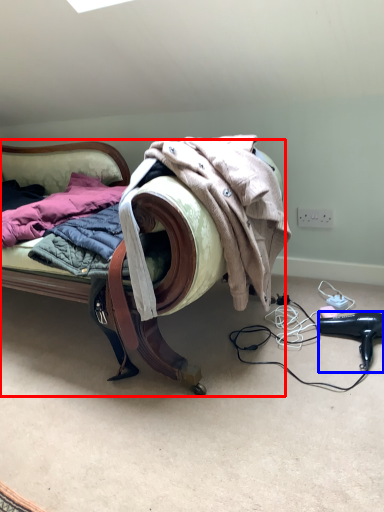
Question: Which point is closer to the camera, furniture (highlighted by a red box) or hair drier (highlighted by a blue box)?

Choices:
 (A) furniture
 (B) hair drier

Answer: (A)